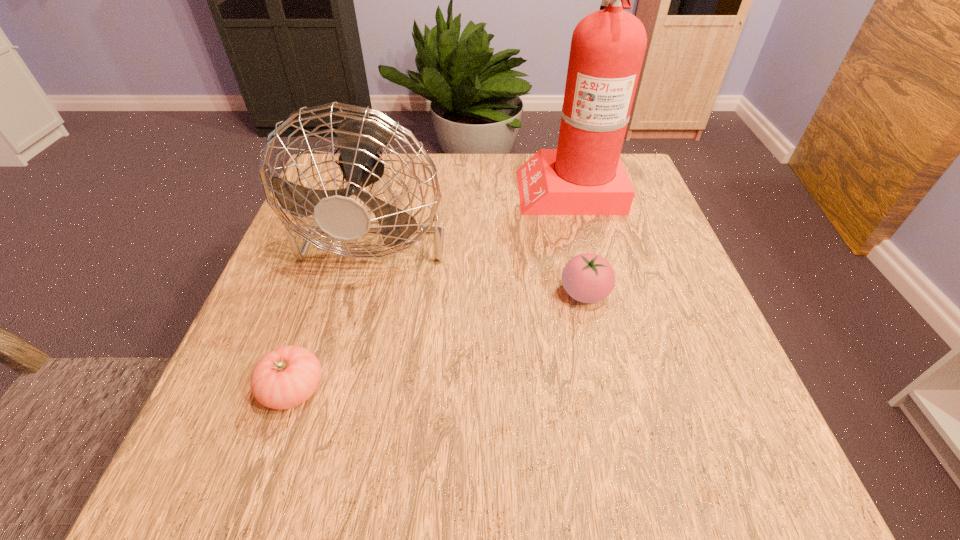
You are a GUI agent. You are given a task and a screenshot of the screen. Output one action in this format:
    pyautogui.click(x=<x>, y=<y>)
    Task: Click on the tallest object
    This screenshot has height=540, width=960.
    Given the screenshot: What is the action you would take?
    pyautogui.click(x=584, y=176)

The height and width of the screenshot is (540, 960). I want to click on the second tallest object, so click(360, 137).

Locate an element on the screen. The image size is (960, 540). the third tallest object is located at coordinates (589, 278).

At what (x,y) coordinates should I click in order to perform the action: click on the right tomato. Please return your answer as a coordinate pair (x, y). Looking at the image, I should click on pyautogui.click(x=589, y=278).

In order to click on the nearest object in this screenshot , I will do `click(286, 377)`.

I want to click on the shorter tomato, so click(286, 377).

Find the location of a particular element. The height and width of the screenshot is (540, 960). free space located on the front-facing side of the fire extinguisher is located at coordinates (467, 188).

Where is `vacant space located on the front-facing side of the fire extinguisher`? The height and width of the screenshot is (540, 960). vacant space located on the front-facing side of the fire extinguisher is located at coordinates (378, 188).

At what (x,y) coordinates should I click in order to perform the action: click on vacant region located 0.160m on the front-facing side of the fire extinguisher. Please return your answer as a coordinate pair (x, y). Image resolution: width=960 pixels, height=540 pixels. Looking at the image, I should click on (454, 188).

Locate an element on the screen. free location located on the front-facing side of the fan is located at coordinates tap(357, 314).